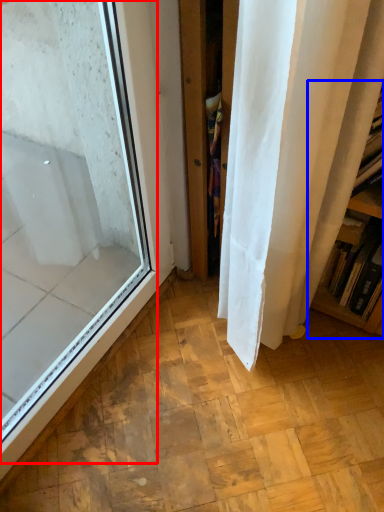
Question: Which object appears farthest to the camera in this image, window (highlighted by a red box) or bookshelf (highlighted by a blue box)?

Choices:
 (A) window
 (B) bookshelf

Answer: (B)